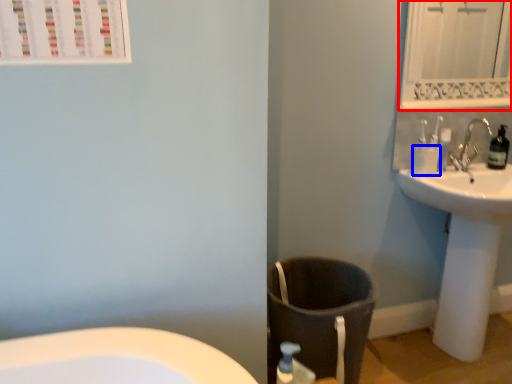
Question: Which point is closer to the camera, mirror (highlighted by a red box) or toilet paper (highlighted by a blue box)?

Choices:
 (A) mirror
 (B) toilet paper

Answer: (A)